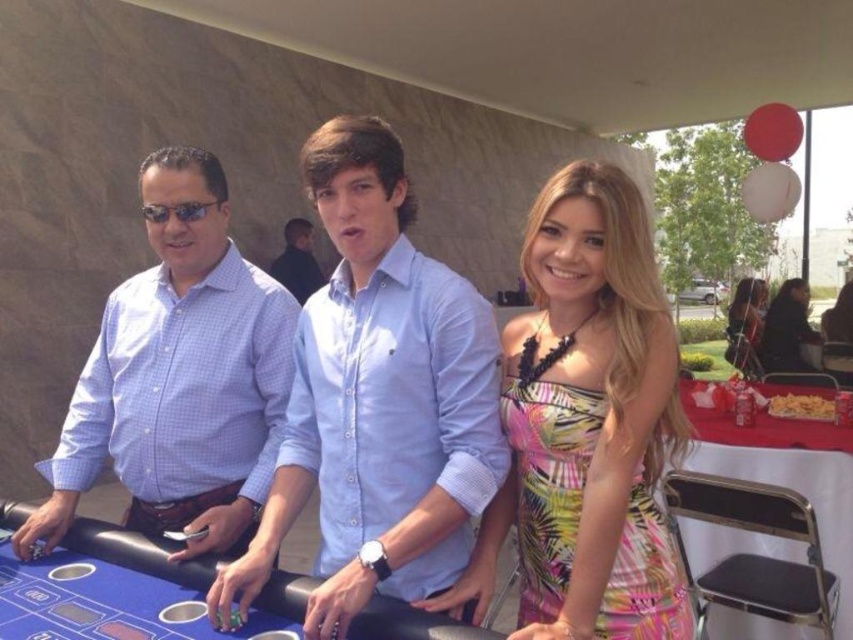
Question: Which of the following is the farthest from the observer?

Choices:
 (A) (102, 380)
 (B) (286, 602)
 (C) (576, 550)

Answer: (A)

Question: Estimate the real-world distances between objects in this image. Which object is farther from the multicolored floral dress at center?

Choices:
 (A) blue felt table at center
 (B) light blue button-down shirt at center

Answer: (A)

Question: Is blue felt table at center below multicolored floral dress at center?

Choices:
 (A) no
 (B) yes

Answer: (B)

Question: Can you confirm if printed silk dress at center is positioned above blue felt table at center?

Choices:
 (A) no
 (B) yes

Answer: (B)

Question: Can you confirm if matte black dress at center is bigger than dark blue shirt at center?

Choices:
 (A) no
 (B) yes

Answer: (B)

Question: Estimate the real-world distances between objects in this image. Which object is farther from the light blue button-down shirt at center?

Choices:
 (A) white plastic table at right
 (B) matte black dress at center
 (C) matte blue shirt at left
 (D) blue felt table at center

Answer: (B)